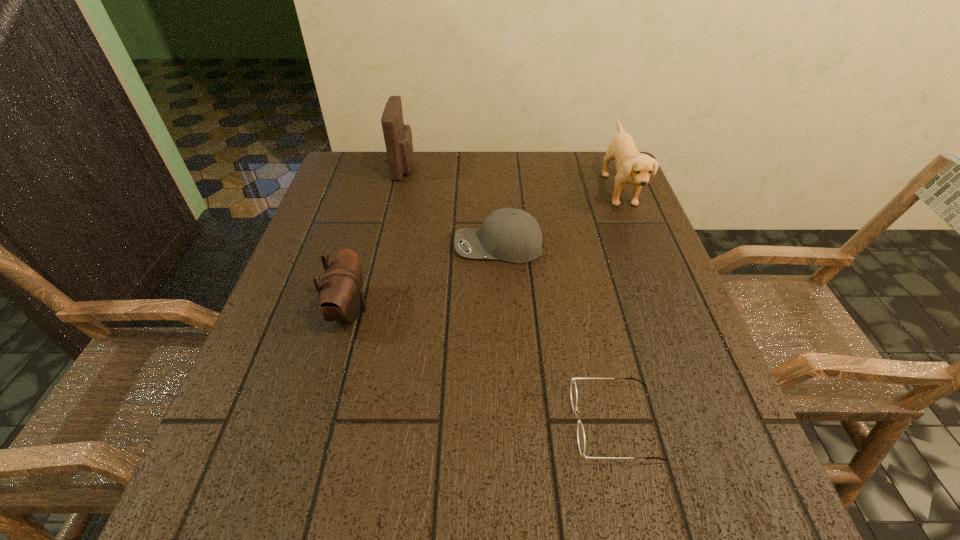
This screenshot has width=960, height=540. Find the location of `vacant space located on the left side of the rightmost object`. vacant space located on the left side of the rightmost object is located at coordinates (492, 190).

I want to click on vacant area situated 0.050m on the left side of the rightmost object, so click(586, 190).

Where is `vacant space located 0.380m with the flap open on the shorter pouch`? vacant space located 0.380m with the flap open on the shorter pouch is located at coordinates (560, 310).

Locate an element on the screen. The width and height of the screenshot is (960, 540). vacant space located on the front brim of the fourth tallest object is located at coordinates point(310,246).

Find the location of a particular element. This screenshot has height=540, width=960. blank area located on the front brim of the fourth tallest object is located at coordinates (394, 246).

At what (x,y) coordinates should I click in order to perform the action: click on vacant space located on the front brim of the fourth tallest object. Please return your answer as a coordinate pair (x, y). This screenshot has width=960, height=540. Looking at the image, I should click on (380, 246).

Locate an element on the screen. free space located 0.070m on the front-facing side of the nearest object is located at coordinates (529, 423).

At what (x,y) coordinates should I click in order to perform the action: click on blank area located on the front-facing side of the nearest object. Please return your answer as a coordinate pair (x, y). Looking at the image, I should click on (422, 423).

Where is `free spot located 0.370m on the front-facing side of the nearest object`? The height and width of the screenshot is (540, 960). free spot located 0.370m on the front-facing side of the nearest object is located at coordinates (342, 423).

Find the location of a particular element. Image resolution: width=960 pixels, height=540 pixels. pouch that is at the far edge is located at coordinates (398, 137).